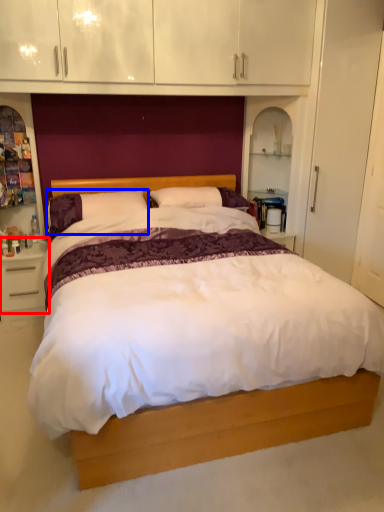
Question: Among these objects, which one is nearest to the camera, nightstand (highlighted by a red box) or pillow (highlighted by a blue box)?

Choices:
 (A) nightstand
 (B) pillow

Answer: (B)